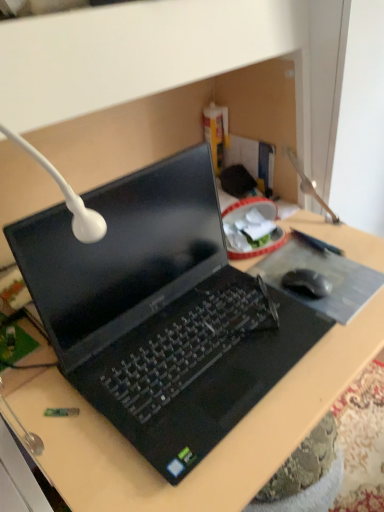
Question: Is black plastic laptop at center at the right side of black matte mousepad at center?

Choices:
 (A) no
 (B) yes

Answer: (A)

Question: Does black plastic laptop at center have a lesser height compared to black matte mousepad at center?

Choices:
 (A) no
 (B) yes

Answer: (A)

Question: From the image's perspective, is black plastic laptop at center located above black matte mousepad at center?

Choices:
 (A) no
 (B) yes

Answer: (B)

Question: Considering the relative sizes of black plastic laptop at center and black matte mousepad at center in the image provided, is black plastic laptop at center smaller than black matte mousepad at center?

Choices:
 (A) no
 (B) yes

Answer: (A)

Question: Is the depth of black plastic laptop at center less than that of black matte mousepad at center?

Choices:
 (A) yes
 (B) no

Answer: (A)

Question: Does black plastic laptop at center have a larger size compared to black matte mousepad at center?

Choices:
 (A) no
 (B) yes

Answer: (B)

Question: Is black rubber mouse at right shorter than black matte mousepad at center?

Choices:
 (A) yes
 (B) no

Answer: (B)

Question: Is black rubber mouse at right located outside black matte mousepad at center?

Choices:
 (A) yes
 (B) no

Answer: (A)

Question: Considering the relative sizes of black rubber mouse at right and black matte mousepad at center in the image provided, is black rubber mouse at right taller than black matte mousepad at center?

Choices:
 (A) no
 (B) yes

Answer: (B)

Question: From the image's perspective, is black rubber mouse at right on black matte mousepad at center?

Choices:
 (A) no
 (B) yes

Answer: (A)

Question: Does black rubber mouse at right appear on the left side of black matte mousepad at center?

Choices:
 (A) no
 (B) yes

Answer: (B)

Question: Considering the relative sizes of black rubber mouse at right and black matte mousepad at center in the image provided, is black rubber mouse at right bigger than black matte mousepad at center?

Choices:
 (A) yes
 (B) no

Answer: (B)

Question: Does black rubber mouse at right touch black plastic laptop at center?

Choices:
 (A) no
 (B) yes

Answer: (A)